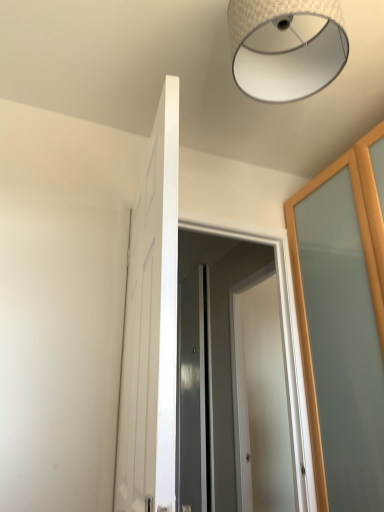
Question: Is white glossy door at center, marked as the second door in a right-to-left arrangement, bigger than satin gray screen door at center?

Choices:
 (A) no
 (B) yes

Answer: (B)

Question: Is white glossy door at center, placed as the 2th door when sorted from back to front, to the right of satin gray screen door at center from the viewer's perspective?

Choices:
 (A) yes
 (B) no

Answer: (B)

Question: Can you confirm if white glossy door at center, which ranks as the 1th door in left-to-right order, is smaller than satin gray screen door at center?

Choices:
 (A) no
 (B) yes

Answer: (A)

Question: Does white glossy door at center, placed as the 2th door when sorted from back to front, come behind satin gray screen door at center?

Choices:
 (A) yes
 (B) no

Answer: (B)

Question: Is white glossy door at center, which is counted as the first door, starting from the front, not inside satin gray screen door at center?

Choices:
 (A) no
 (B) yes

Answer: (B)

Question: Would you say white glossy door at center, which is counted as the first door, starting from the front, is to the left or to the right of woven fabric lampshade at upper center in the picture?

Choices:
 (A) left
 (B) right

Answer: (A)

Question: From the image's perspective, is white glossy door at center, which ranks as the 1th door in left-to-right order, positioned above or below woven fabric lampshade at upper center?

Choices:
 (A) below
 (B) above

Answer: (A)

Question: Looking at their shapes, would you say white glossy door at center, placed as the 2th door when sorted from back to front, is wider or thinner than woven fabric lampshade at upper center?

Choices:
 (A) wide
 (B) thin

Answer: (B)

Question: From their relative heights in the image, would you say white glossy door at center, which ranks as the 1th door in left-to-right order, is taller or shorter than woven fabric lampshade at upper center?

Choices:
 (A) tall
 (B) short

Answer: (A)

Question: Considering their positions, is satin gray screen door at center located in front of or behind white glossy door at center, positioned as the 1th door in back-to-front order?

Choices:
 (A) behind
 (B) front

Answer: (B)

Question: Is satin gray screen door at center inside or outside of white glossy door at center, arranged as the 2th door when viewed from the front?

Choices:
 (A) inside
 (B) outside

Answer: (B)

Question: From a real-world perspective, is satin gray screen door at center physically located above or below white glossy door at center, positioned as the 2th door in left-to-right order?

Choices:
 (A) above
 (B) below

Answer: (A)

Question: Is satin gray screen door at center bigger or smaller than white glossy door at center, positioned as the 2th door in left-to-right order?

Choices:
 (A) small
 (B) big

Answer: (A)

Question: Is woven fabric lampshade at upper center wider or thinner than satin gray screen door at center?

Choices:
 (A) wide
 (B) thin

Answer: (A)

Question: Is woven fabric lampshade at upper center bigger or smaller than satin gray screen door at center?

Choices:
 (A) small
 (B) big

Answer: (A)